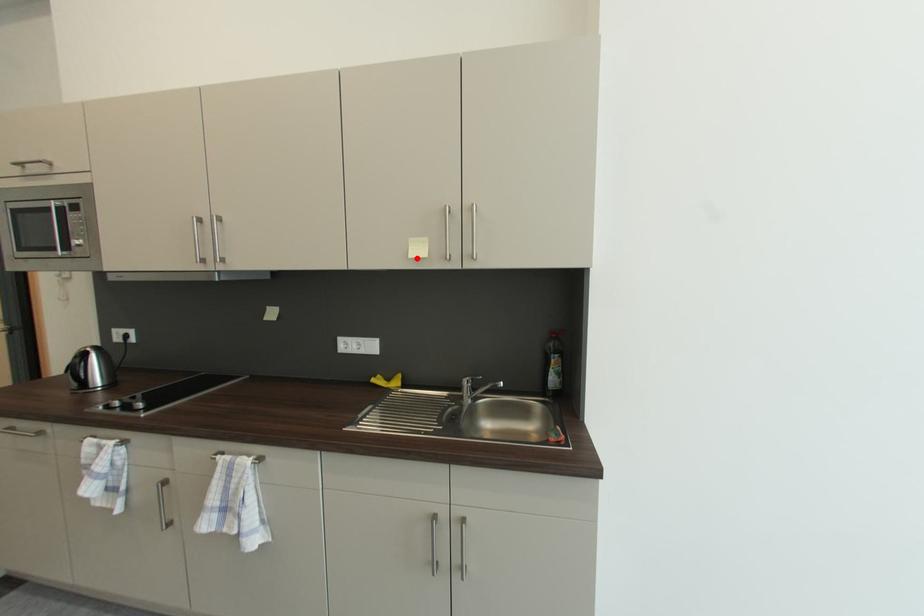
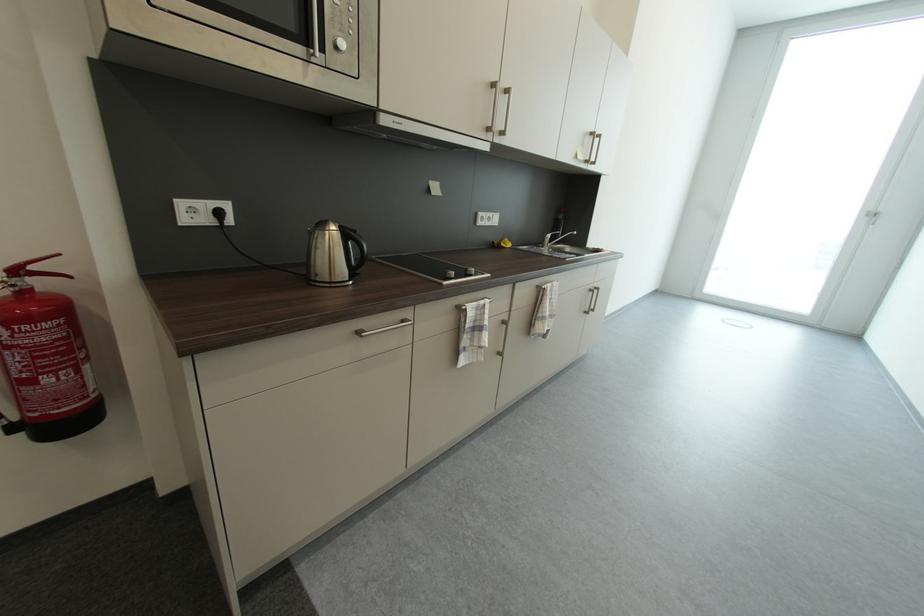
Find the pixel in the second image that matches the highlighted location in the first image.

(585, 160)